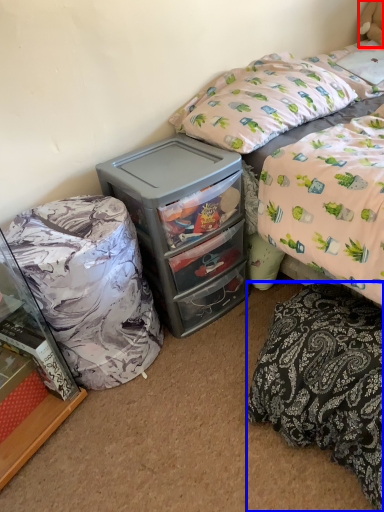
Question: Which object is further to the camera taking this photo, teddy bear (highlighted by a red box) or mattress (highlighted by a blue box)?

Choices:
 (A) teddy bear
 (B) mattress

Answer: (A)